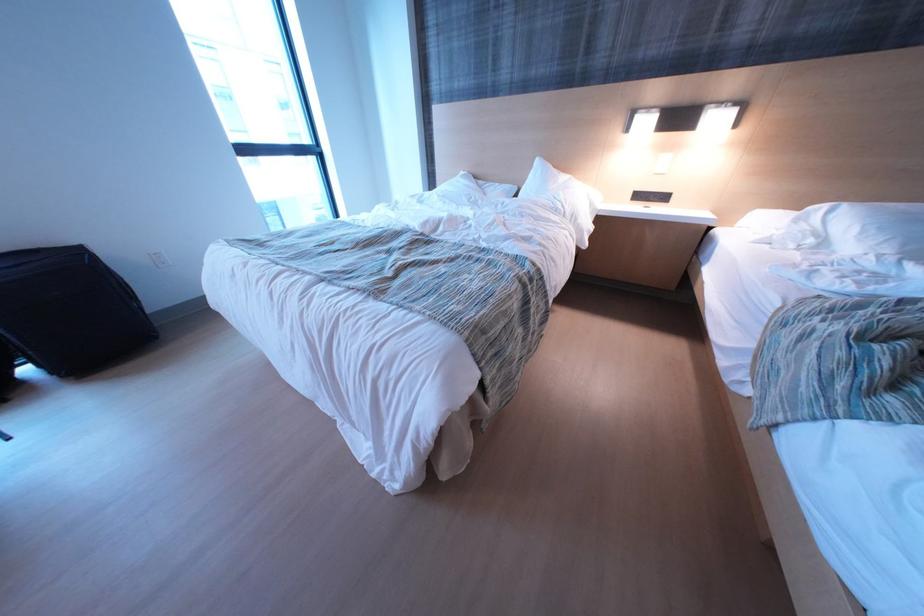
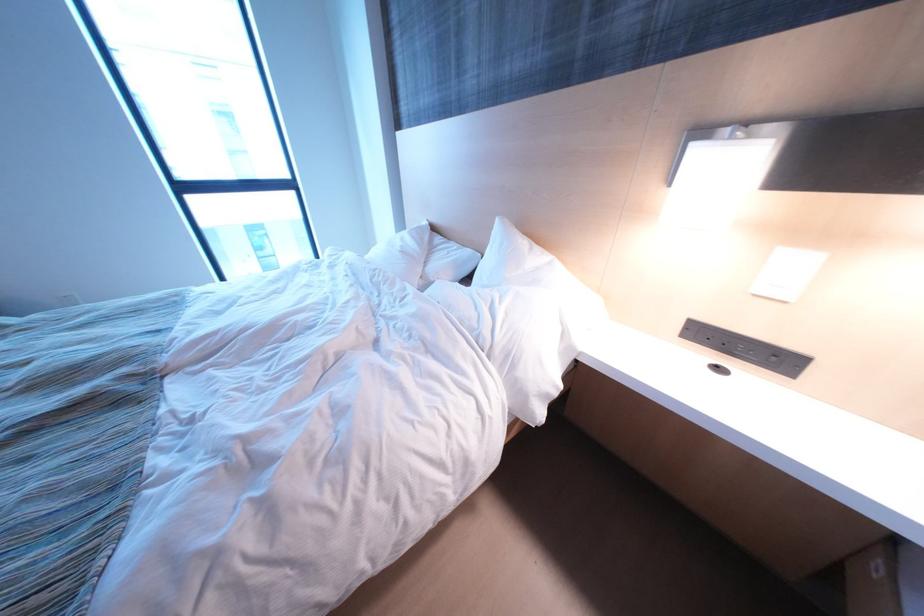
In the scene shown: In a continuous first-person perspective shot, in which direction is the camera moving?

The movement direction of the cameraman is right, forward.